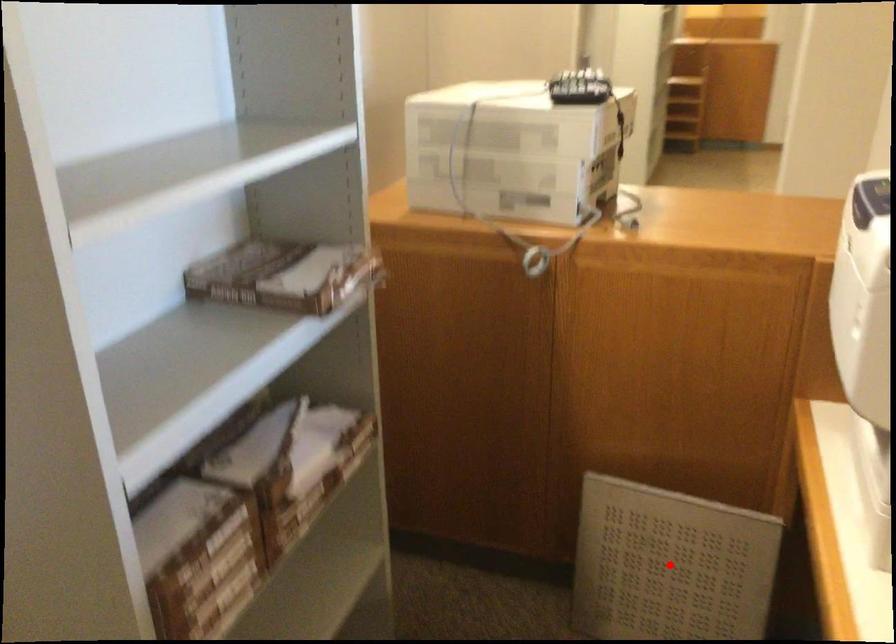
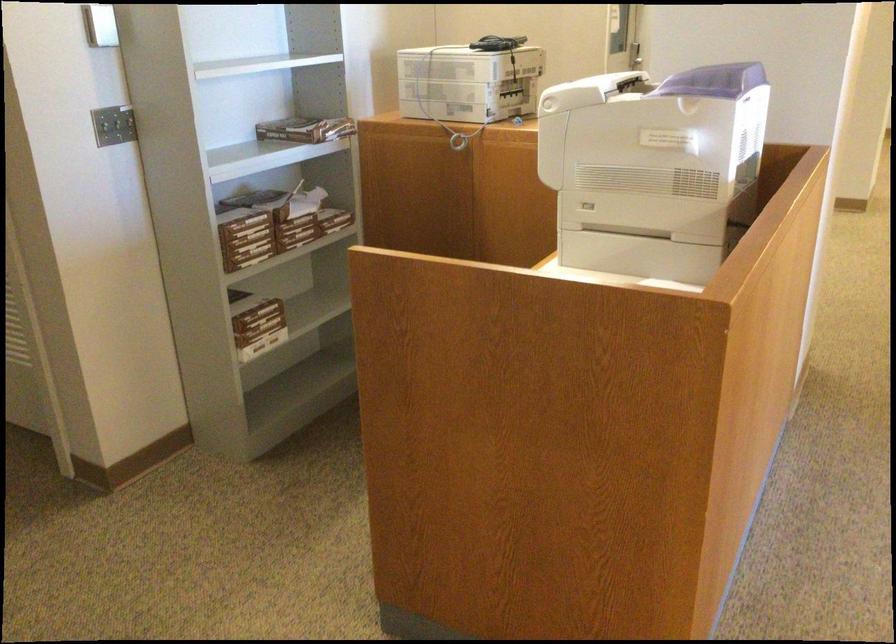
Question: I am providing you with two images of the same scene from different viewpoints. A red point is marked on the first image. At the location where the point appears in image 1, is it still visible in image 2?

Choices:
 (A) Yes
 (B) No

Answer: (B)